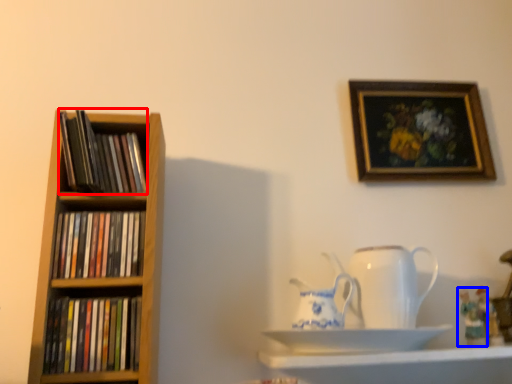
Question: Which object appears farthest to the camera in this image, book (highlighted by a red box) or toy (highlighted by a blue box)?

Choices:
 (A) book
 (B) toy

Answer: (B)